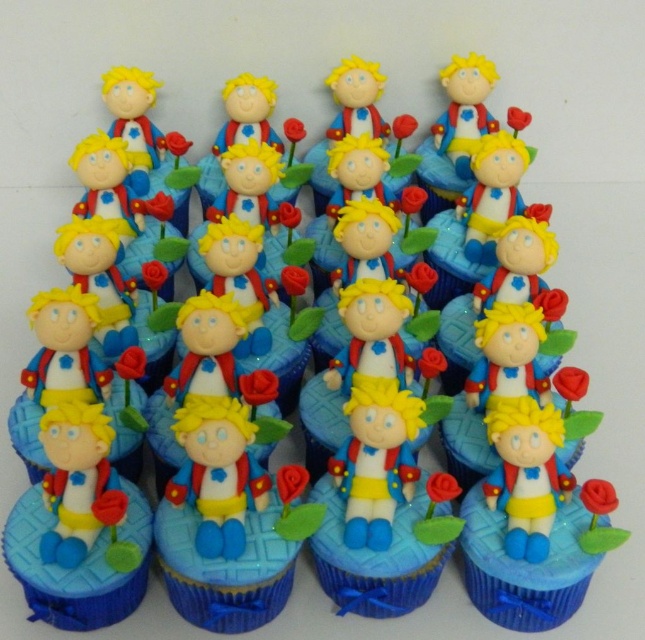
You are a baker who needs to place a new cupcake exactly at the center of the table. You have a matte blue cupcake at center. Based on its current position, can you determine if it is already centered?

The matte blue cupcake at center is located at coordinates point (524, 566), which does not align with the exact center point of the table, so it is not perfectly centered.

You are a customer at a bakery and want to choose a cupcake with a fondant figurine. The cupcakes are arranged in a display case with coordinates marked for selection. You see two points labeled as point (504, 611) and point (410, 600). Which point corresponds to a cupcake that is closer to you?

Point (504, 611) is in front of point (410, 600), so the cupcake at point (504, 611) is closer to you.